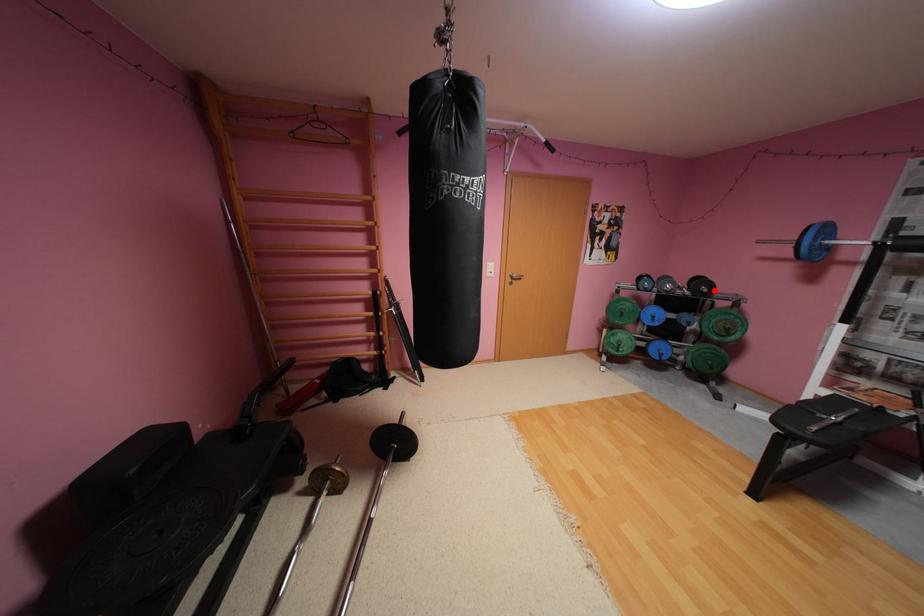
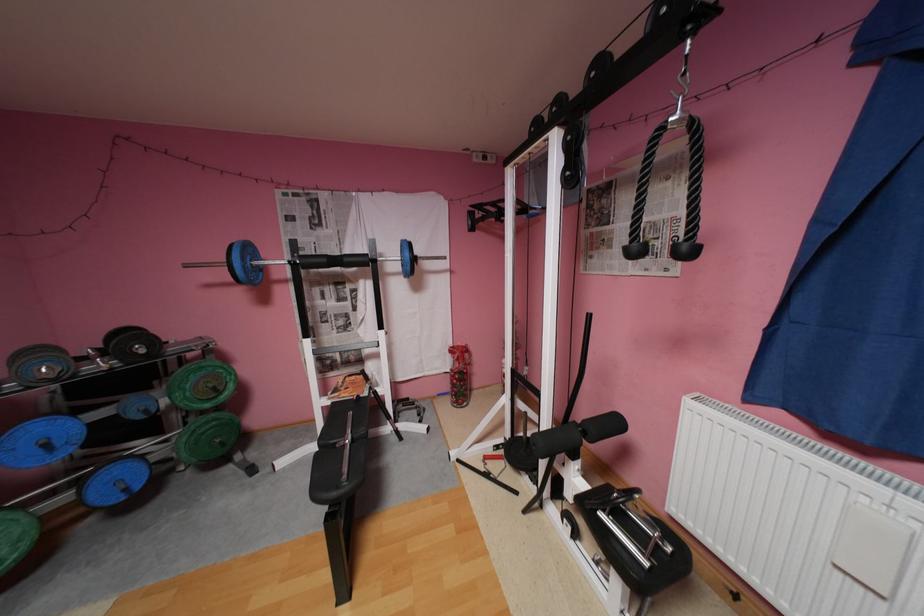
Where in the second image is the point corresponding to the highlighted location from the first image?

(152, 351)